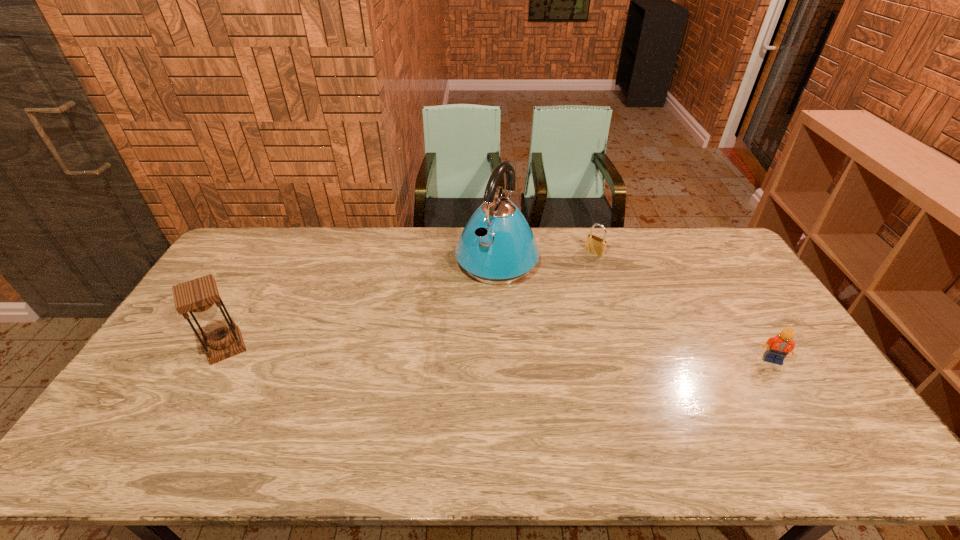
In order to click on vacant space situated on the front-facing side of the padlock in this screenshot , I will do `click(553, 287)`.

You are a GUI agent. You are given a task and a screenshot of the screen. Output one action in this format:
    pyautogui.click(x=<x>, y=<y>)
    Task: Click on the vacant space located at the spout of the tallest object
    The width and height of the screenshot is (960, 540).
    Given the screenshot: What is the action you would take?
    pyautogui.click(x=456, y=319)

Where is `vacant area situated at the spout of the tallest object`? This screenshot has height=540, width=960. vacant area situated at the spout of the tallest object is located at coordinates (435, 348).

Find the location of a particular element. This screenshot has width=960, height=540. free spot located at the spout of the tallest object is located at coordinates point(426,361).

Where is `padlock that is positioned at the far edge`? This screenshot has width=960, height=540. padlock that is positioned at the far edge is located at coordinates (595, 245).

Where is `kettle present at the far edge`? The width and height of the screenshot is (960, 540). kettle present at the far edge is located at coordinates (497, 246).

Locate an element on the screen. The image size is (960, 540). object that is at the left edge is located at coordinates click(x=200, y=297).

At what (x,y) coordinates should I click in order to perform the action: click on object that is at the right edge. Please return your answer as a coordinate pair (x, y). The image size is (960, 540). Looking at the image, I should click on coord(778,347).

Find the location of a particular element. vacant space at the far edge of the desktop is located at coordinates (376, 266).

You are a GUI agent. You are given a task and a screenshot of the screen. Output one action in this format:
    pyautogui.click(x=<x>, y=<y>)
    Task: Click on the vacant space at the near edge of the desktop
    
    Given the screenshot: What is the action you would take?
    tap(735, 401)